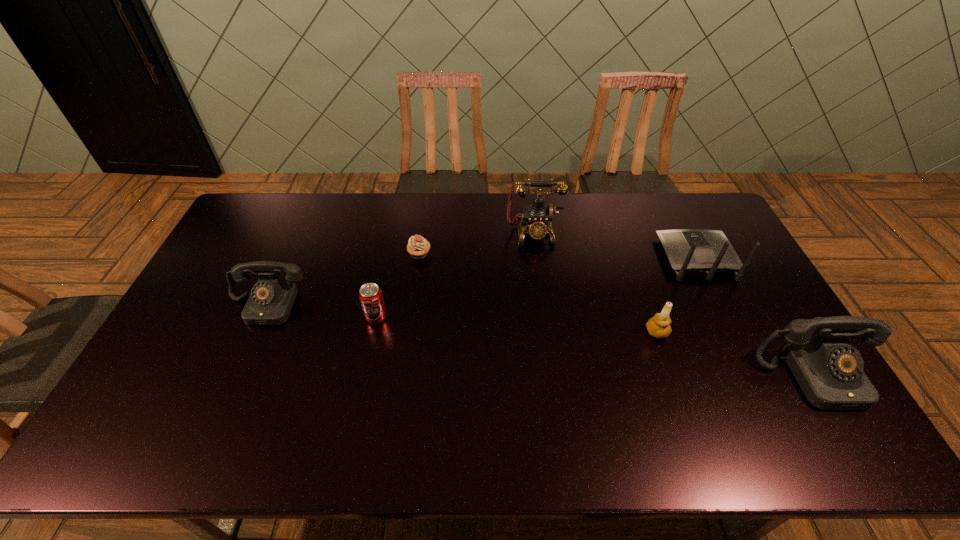
Please mark a free spot for a new telephone to balance the arrangement. Please provide its 2D coordinates. Your answer should be formatted as a tuple, i.e. [(x, y)], where the tuple contains the x and y coordinates of a point satisfying the conditions above.

[(522, 339)]